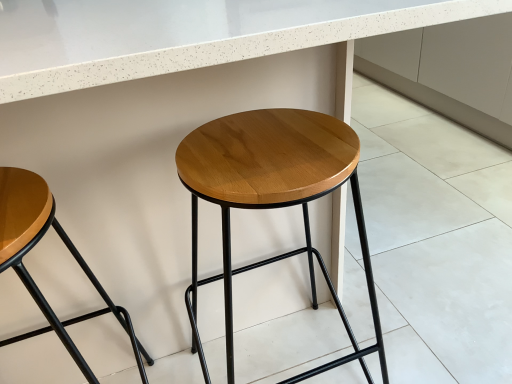
Question: Which direction should I rotate to face wooden/matte stool at center, which is the second stool in left-to-right order, — up or down?

Choices:
 (A) down
 (B) up

Answer: (A)

Question: Is wooden/matte stool at center, placed as the 1th stool when sorted from right to left, taller than wooden seat at left, the 1th stool when ordered from left to right?

Choices:
 (A) no
 (B) yes

Answer: (B)

Question: Considering the relative sizes of wooden/matte stool at center, placed as the 1th stool when sorted from right to left, and wooden seat at left, the 1th stool when ordered from left to right, in the image provided, is wooden/matte stool at center, placed as the 1th stool when sorted from right to left, shorter than wooden seat at left, the 1th stool when ordered from left to right,?

Choices:
 (A) yes
 (B) no

Answer: (B)

Question: From the image's perspective, would you say wooden/matte stool at center, which is the second stool in left-to-right order, is positioned over wooden seat at left, the 2th stool from the right?

Choices:
 (A) no
 (B) yes

Answer: (B)

Question: Is wooden/matte stool at center, placed as the 1th stool when sorted from right to left, bigger than wooden seat at left, the 1th stool when ordered from left to right?

Choices:
 (A) no
 (B) yes

Answer: (B)

Question: Does wooden/matte stool at center, which is the second stool in left-to-right order, have a lesser width compared to wooden seat at left, the 1th stool when ordered from left to right?

Choices:
 (A) yes
 (B) no

Answer: (B)

Question: Are wooden seat at left, the 1th stool when ordered from left to right, and wooden/matte stool at center, which is the second stool in left-to-right order, far apart?

Choices:
 (A) no
 (B) yes

Answer: (A)

Question: From the image's perspective, is wooden seat at left, the 2th stool from the right, on wooden/matte stool at center, placed as the 1th stool when sorted from right to left?

Choices:
 (A) yes
 (B) no

Answer: (B)

Question: Is wooden seat at left, the 2th stool from the right, smaller than wooden/matte stool at center, which is the second stool in left-to-right order?

Choices:
 (A) no
 (B) yes

Answer: (B)

Question: Can you confirm if wooden seat at left, the 2th stool from the right, is positioned to the left of wooden/matte stool at center, placed as the 1th stool when sorted from right to left?

Choices:
 (A) no
 (B) yes

Answer: (B)

Question: Considering the relative sizes of wooden seat at left, the 2th stool from the right, and wooden/matte stool at center, which is the second stool in left-to-right order, in the image provided, is wooden seat at left, the 2th stool from the right, bigger than wooden/matte stool at center, which is the second stool in left-to-right order,?

Choices:
 (A) no
 (B) yes

Answer: (A)

Question: Considering the relative positions of wooden seat at left, the 1th stool when ordered from left to right, and wooden/matte stool at center, which is the second stool in left-to-right order, in the image provided, is wooden seat at left, the 1th stool when ordered from left to right, behind wooden/matte stool at center, which is the second stool in left-to-right order,?

Choices:
 (A) yes
 (B) no

Answer: (B)

Question: Is point (307, 157) positioned closer to the camera than point (72, 319)?

Choices:
 (A) closer
 (B) farther

Answer: (A)